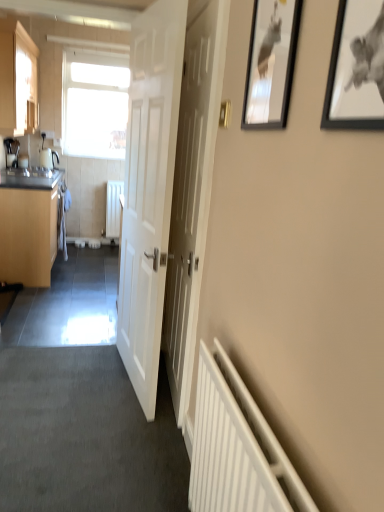
Question: Does white matte radiator at center, the 2th radiator when ordered from bottom to top, have a smaller size compared to white fabric laundry at left?

Choices:
 (A) yes
 (B) no

Answer: (B)

Question: Considering the relative sizes of white matte radiator at center, the 2th radiator when ordered from bottom to top, and white fabric laundry at left in the image provided, is white matte radiator at center, the 2th radiator when ordered from bottom to top, wider than white fabric laundry at left?

Choices:
 (A) yes
 (B) no

Answer: (A)

Question: Is white matte radiator at center, which is the second radiator in front-to-back order, closer to camera compared to white fabric laundry at left?

Choices:
 (A) no
 (B) yes

Answer: (A)

Question: From a real-world perspective, is white matte radiator at center, which is the 1th radiator from top to bottom, over white fabric laundry at left?

Choices:
 (A) no
 (B) yes

Answer: (B)

Question: Can you confirm if white matte radiator at center, the 2th radiator when ordered from bottom to top, is thinner than white fabric laundry at left?

Choices:
 (A) yes
 (B) no

Answer: (B)

Question: Is white matte radiator at center, positioned as the 1th radiator in back-to-front order, located outside white fabric laundry at left?

Choices:
 (A) yes
 (B) no

Answer: (A)

Question: Considering the relative positions of white fabric laundry at left and black glossy picture frame at upper right, the 1th picture frame positioned from the left, in the image provided, is white fabric laundry at left to the left of black glossy picture frame at upper right, the 1th picture frame positioned from the left, from the viewer's perspective?

Choices:
 (A) yes
 (B) no

Answer: (A)

Question: Considering the relative positions of white fabric laundry at left and black glossy picture frame at upper right, which appears as the first picture frame when viewed from the back, in the image provided, is white fabric laundry at left to the right of black glossy picture frame at upper right, which appears as the first picture frame when viewed from the back, from the viewer's perspective?

Choices:
 (A) yes
 (B) no

Answer: (B)

Question: Can you confirm if white fabric laundry at left is thinner than black glossy picture frame at upper right, the second picture frame in the right-to-left sequence?

Choices:
 (A) no
 (B) yes

Answer: (A)

Question: Can you confirm if white fabric laundry at left is taller than black glossy picture frame at upper right, the second picture frame in the right-to-left sequence?

Choices:
 (A) yes
 (B) no

Answer: (A)

Question: Does white fabric laundry at left lie behind black glossy picture frame at upper right, the 1th picture frame positioned from the left?

Choices:
 (A) yes
 (B) no

Answer: (A)

Question: Can you confirm if white fabric laundry at left is smaller than black glossy picture frame at upper right, the 1th picture frame positioned from the left?

Choices:
 (A) yes
 (B) no

Answer: (B)

Question: Can you confirm if black glossy picture frame at upper right, the 1th picture frame positioned from the left, is positioned to the right of white matte radiator at center, acting as the second radiator starting from the right?

Choices:
 (A) no
 (B) yes

Answer: (B)